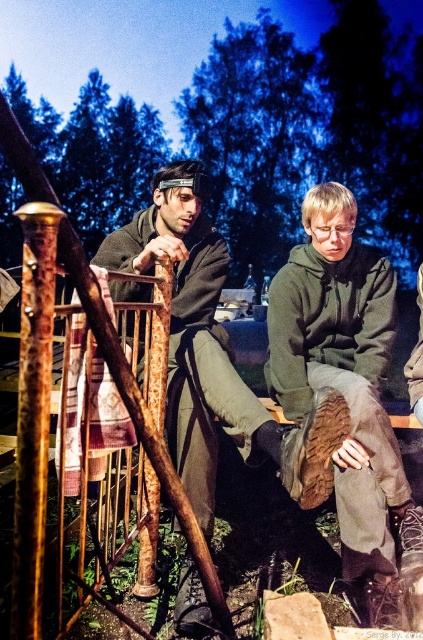
Question: Does green fuzzy hoodie at center appear over matte brown wooden stick at left?

Choices:
 (A) yes
 (B) no

Answer: (B)

Question: Which point is closer to the camera taking this photo?

Choices:
 (A) (277, 442)
 (B) (335, 488)

Answer: (A)

Question: Does green fuzzy hoodie at center appear on the right side of matte brown wooden stick at left?

Choices:
 (A) no
 (B) yes

Answer: (B)

Question: Among these objects, which one is farthest from the camera?

Choices:
 (A) green fuzzy hoodie at center
 (B) matte brown wooden stick at left

Answer: (A)

Question: Can you confirm if green fuzzy hoodie at center is positioned to the right of matte brown wooden stick at left?

Choices:
 (A) no
 (B) yes

Answer: (B)